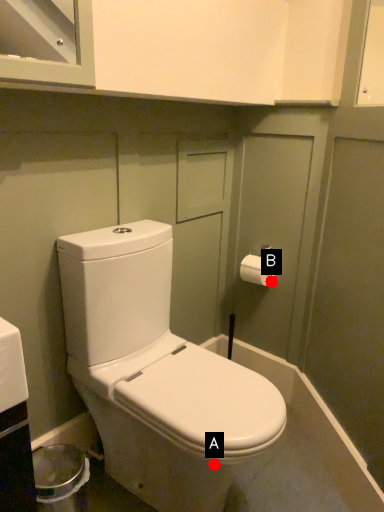
Question: Two points are circled on the image, labeled by A and B beside each circle. Which point is closer to the camera?

Choices:
 (A) A is closer
 (B) B is closer

Answer: (A)